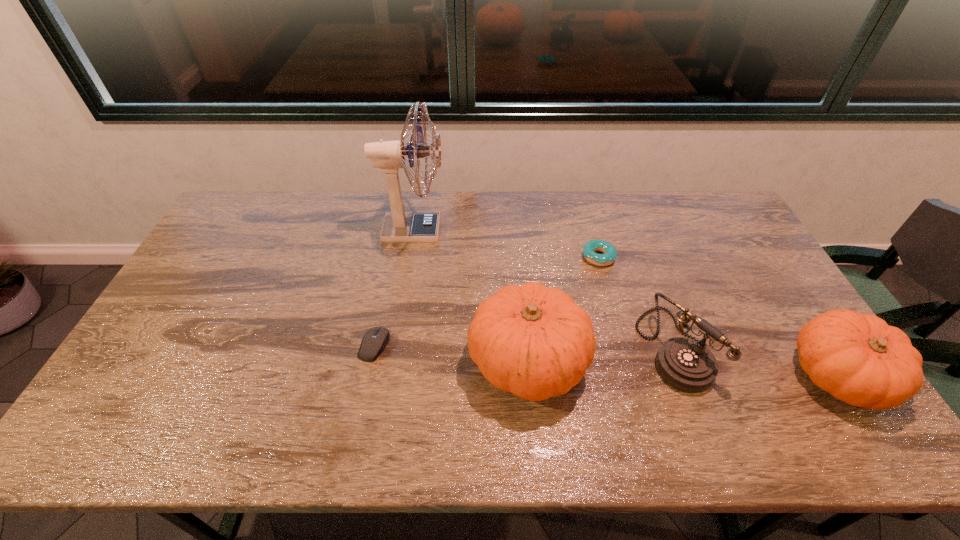
In order to click on blank space at the near left corner of the desktop in this screenshot , I will do `click(132, 392)`.

At what (x,y) coordinates should I click in order to perform the action: click on free area in between the computer equipment and the rightmost object. Please return your answer as a coordinate pair (x, y). This screenshot has height=540, width=960. Looking at the image, I should click on (606, 361).

Find the location of a particular element. The height and width of the screenshot is (540, 960). vacant space in between the left pumpkin and the telephone is located at coordinates (600, 354).

Where is `free space between the right pumpkin and the computer equipment`? This screenshot has height=540, width=960. free space between the right pumpkin and the computer equipment is located at coordinates (606, 361).

You are a GUI agent. You are given a task and a screenshot of the screen. Output one action in this format:
    pyautogui.click(x=<x>, y=<y>)
    Task: Click on the free space between the tallest object and the doughnut
    This screenshot has height=540, width=960.
    Given the screenshot: What is the action you would take?
    pyautogui.click(x=506, y=244)

Identify the location of empty space between the telephone and the right pumpkin. Image resolution: width=960 pixels, height=540 pixels. (756, 362).

Identify the location of free space between the taller pumpkin and the computer equipment. (451, 353).

Identify the location of empty space that is in between the shorter pumpkin and the doughnut. (718, 316).

Point out which object is positioned as the nearest to the computer equipment. Please provide its 2D coordinates. Your answer should be formatted as a tuple, i.e. [(x, y)], where the tuple contains the x and y coordinates of a point satisfying the conditions above.

[(535, 342)]

Identify the location of object that is the second closest to the telephone. The height and width of the screenshot is (540, 960). (609, 251).